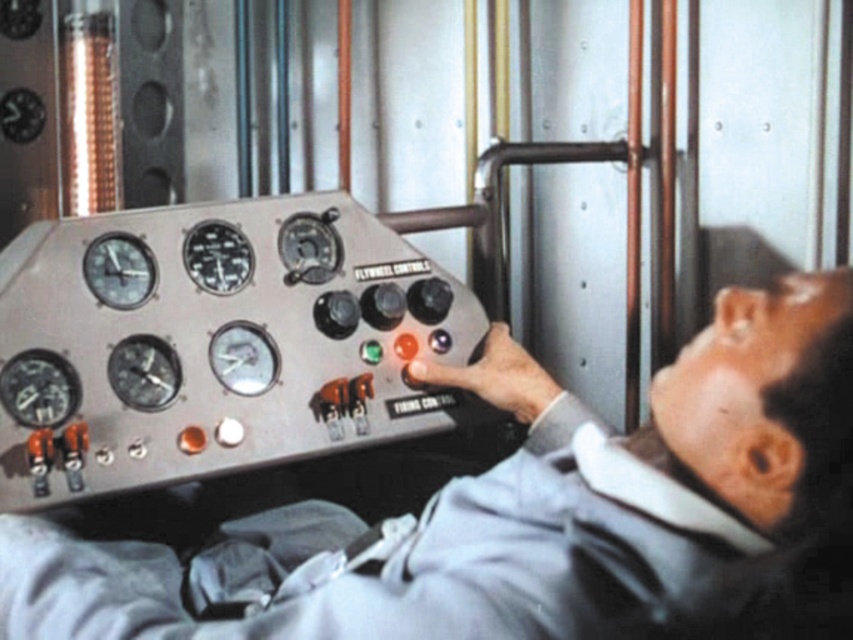
Question: Is metallic clock at upper left wider than metallic gauge at center?

Choices:
 (A) yes
 (B) no

Answer: (B)

Question: Can you confirm if metallic gray control panel at center is thinner than metallic clock at upper left?

Choices:
 (A) yes
 (B) no

Answer: (B)

Question: Does metallic gauge at upper left have a lesser width compared to metallic gauge at center?

Choices:
 (A) yes
 (B) no

Answer: (B)

Question: Which point is farther from the camera taking this photo?

Choices:
 (A) (676, 570)
 (B) (254, 336)

Answer: (B)

Question: Based on their relative distances, which object is nearer to the metallic gray control panel at center?

Choices:
 (A) metallic clock at upper left
 (B) metallic gauge at center

Answer: (B)

Question: Among these objects, which one is farthest from the camera?

Choices:
 (A) metallic gray control panel at center
 (B) metallic gauge at upper left

Answer: (B)